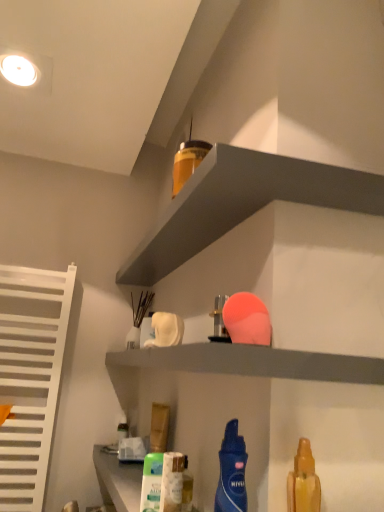
Question: Is blue matte lotion at center, which is the 3th cleaning product in bottom-to-top order, wider or thinner than translucent plastic spray bottle at center, the 1th cleaning product in the left-to-right sequence?

Choices:
 (A) wide
 (B) thin

Answer: (A)

Question: Is blue matte lotion at center, the second cleaning product viewed from the front, to the left or to the right of translucent plastic spray bottle at center, acting as the third cleaning product starting from the front, in the image?

Choices:
 (A) left
 (B) right

Answer: (B)

Question: Estimate the real-world distances between objects in this image. Which object is farther from the white slatted radiator at left?

Choices:
 (A) matte gray shelf at upper center, which is counted as the 1th shelf, starting from the top
 (B) white matte shelf at upper center, the first shelf positioned from the bottom
 (C) translucent yellow spray bottle at lower right, positioned as the second cleaning product in bottom-to-top order
 (D) blue matte lotion at center, which is the 3th cleaning product in bottom-to-top order
 (E) translucent plastic bottle at upper center, the 4th cleaning product positioned from the front

Answer: (C)

Question: Which object is the closest to the white slatted radiator at left?

Choices:
 (A) matte gray shelf at upper center, positioned as the 2th shelf in bottom-to-top order
 (B) white matte shelf at upper center, marked as the 2th shelf in a top-to-bottom arrangement
 (C) blue matte lotion at center, which is the 3th cleaning product in bottom-to-top order
 (D) translucent yellow spray bottle at lower right, the fourth cleaning product in the back-to-front sequence
 (E) translucent plastic spray bottle at center, which is the 4th cleaning product from top to bottom

Answer: (A)